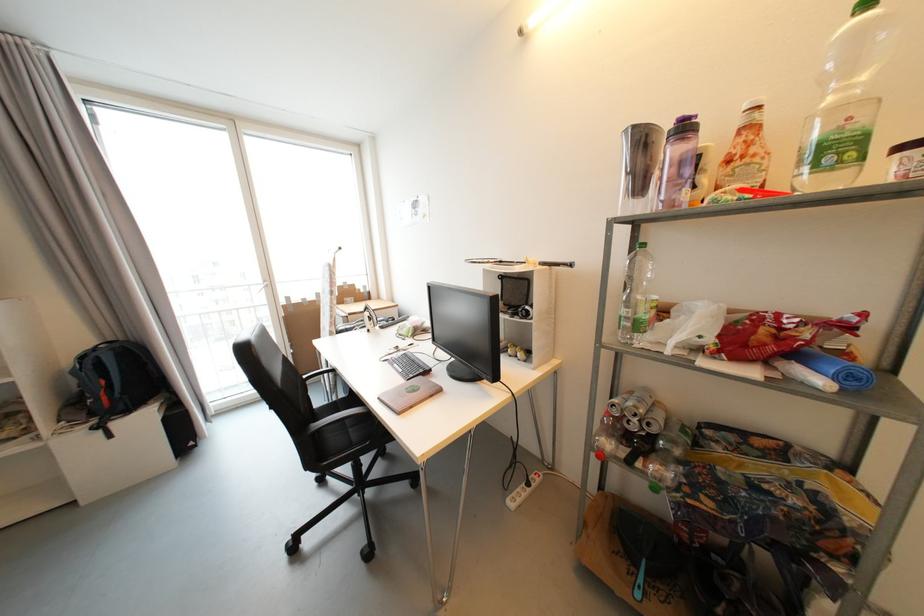
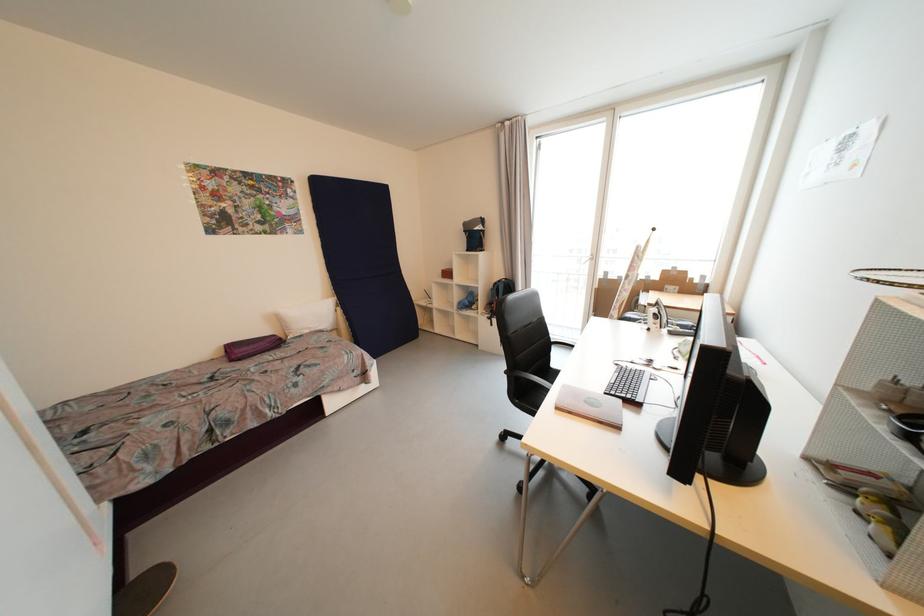
In the second image, find the point that corresponds to (x=89, y=359) in the first image.

(501, 285)